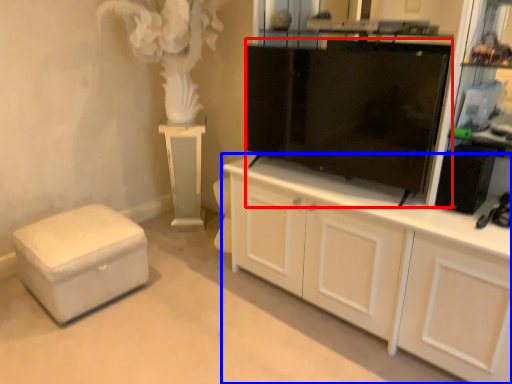
Question: Which object appears farthest to the camera in this image, tv cabinet (highlighted by a red box) or cabinetry (highlighted by a blue box)?

Choices:
 (A) tv cabinet
 (B) cabinetry

Answer: (A)